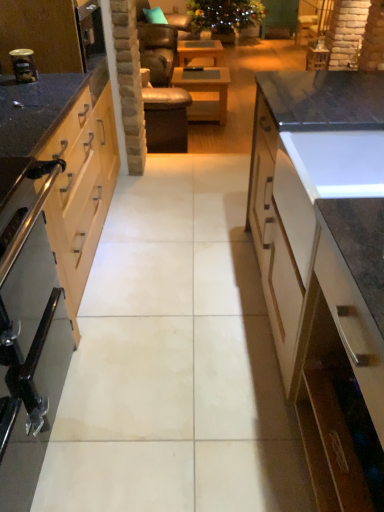
Question: From a real-world perspective, is wooden table at center, the 1th table positioned from the back, located beneath stainless steel oven at left?

Choices:
 (A) no
 (B) yes

Answer: (B)

Question: Does wooden table at center, the 1th table positioned from the back, have a smaller size compared to stainless steel oven at left?

Choices:
 (A) no
 (B) yes

Answer: (B)

Question: Would you consider wooden table at center, the 1th table positioned from the back, to be distant from stainless steel oven at left?

Choices:
 (A) yes
 (B) no

Answer: (A)

Question: Is wooden table at center, the 1th table positioned from the back, next to stainless steel oven at left?

Choices:
 (A) no
 (B) yes

Answer: (A)

Question: From a real-world perspective, is wooden table at center, which is counted as the first table, starting from the top, located higher than stainless steel oven at left?

Choices:
 (A) no
 (B) yes

Answer: (A)

Question: From a real-world perspective, is metallic silver canister at left above or below stainless steel oven at left?

Choices:
 (A) below
 (B) above

Answer: (B)

Question: Considering the positions of point (18, 74) and point (36, 455), is point (18, 74) closer or farther from the camera than point (36, 455)?

Choices:
 (A) closer
 (B) farther

Answer: (B)

Question: Considering their positions, is metallic silver canister at left located in front of or behind stainless steel oven at left?

Choices:
 (A) front
 (B) behind

Answer: (B)

Question: Choose the correct answer: Is metallic silver canister at left inside stainless steel oven at left or outside it?

Choices:
 (A) inside
 (B) outside

Answer: (B)

Question: Based on their positions, is wooden table at center, the 2th table viewed from the front, located to the left or right of teal fabric pillow at upper center?

Choices:
 (A) left
 (B) right

Answer: (B)

Question: From their relative heights in the image, would you say wooden table at center, the 1th table positioned from the back, is taller or shorter than teal fabric pillow at upper center?

Choices:
 (A) short
 (B) tall

Answer: (B)

Question: Relative to teal fabric pillow at upper center, is wooden table at center, the second table from the bottom, in front or behind?

Choices:
 (A) behind
 (B) front

Answer: (B)

Question: Is wooden table at center, the second table from the bottom, wider or thinner than teal fabric pillow at upper center?

Choices:
 (A) wide
 (B) thin

Answer: (A)

Question: Considering the positions of wooden at center, which appears as the 2th table when viewed from the top, and metallic silver toaster at left in the image, is wooden at center, which appears as the 2th table when viewed from the top, taller or shorter than metallic silver toaster at left?

Choices:
 (A) tall
 (B) short

Answer: (A)

Question: Based on their positions, is wooden at center, which appears as the 2th table when viewed from the top, located to the left or right of metallic silver toaster at left?

Choices:
 (A) left
 (B) right

Answer: (B)